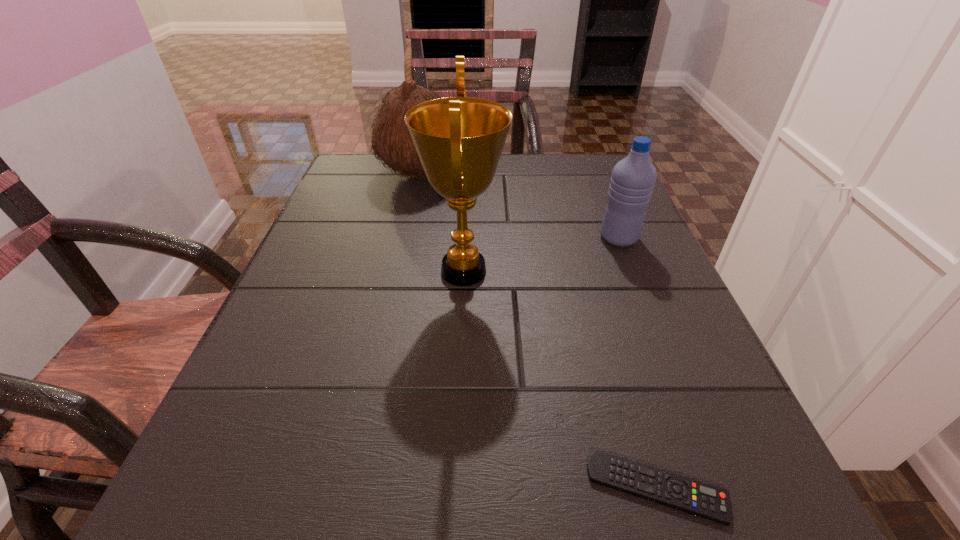
Find the location of `object positioned at the far edge`. object positioned at the far edge is located at coordinates pos(392,141).

Where is `object that is positioned at the near edge`? Image resolution: width=960 pixels, height=540 pixels. object that is positioned at the near edge is located at coordinates (710, 502).

Where is `object at the left edge`? The width and height of the screenshot is (960, 540). object at the left edge is located at coordinates (392, 141).

You are a GUI agent. You are given a task and a screenshot of the screen. Output one action in this format:
    pyautogui.click(x=<x>, y=<y>)
    Task: Click on the water bottle located at the right edge
    This screenshot has width=960, height=540.
    Given the screenshot: What is the action you would take?
    pyautogui.click(x=633, y=178)

Locate an element on the screen. remote control that is at the right edge is located at coordinates (710, 502).

Locate an element on the screen. object located at the far left corner is located at coordinates (392, 141).

In order to click on object located in the near right corner section of the desktop in this screenshot , I will do `click(710, 502)`.

This screenshot has height=540, width=960. Find the location of `vacant region at the far edge of the desktop`. vacant region at the far edge of the desktop is located at coordinates (515, 158).

The height and width of the screenshot is (540, 960). What are the coordinates of `vacant position at the near edge of the desktop` in the screenshot? It's located at (540, 486).

In the image, there is a desktop. At what (x,y) coordinates should I click in order to perform the action: click on vacant space at the left edge. Please return your answer as a coordinate pair (x, y). The height and width of the screenshot is (540, 960). Looking at the image, I should click on (263, 376).